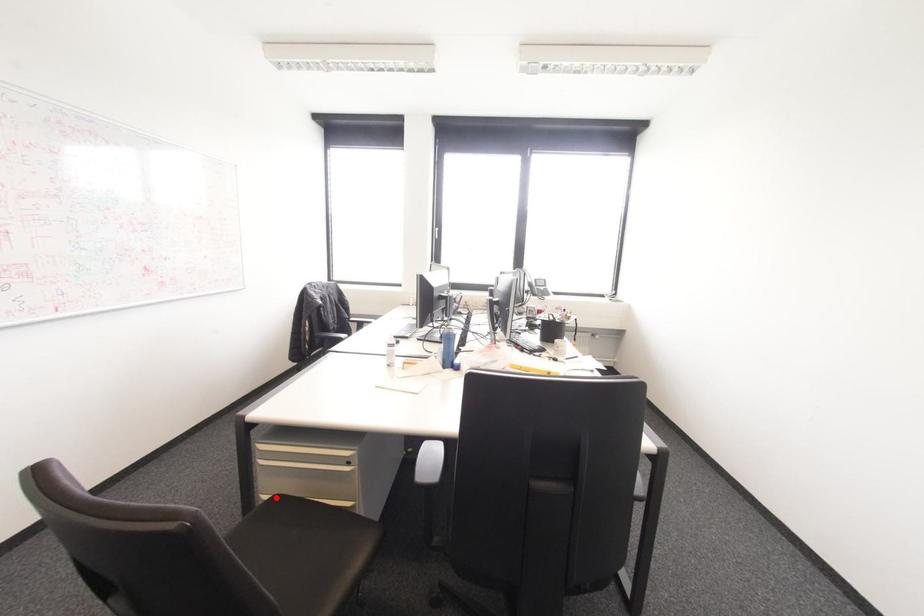
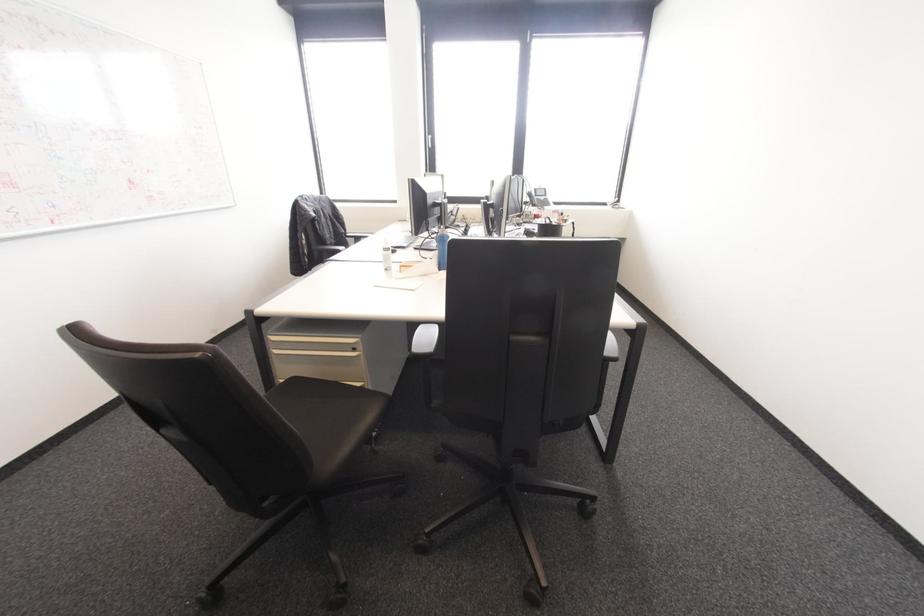
Question: I am providing you with two images of the same scene from different viewpoints. A red point is marked on the first image. Is the red point's position out of view in image 2?

Choices:
 (A) Yes
 (B) No

Answer: (B)